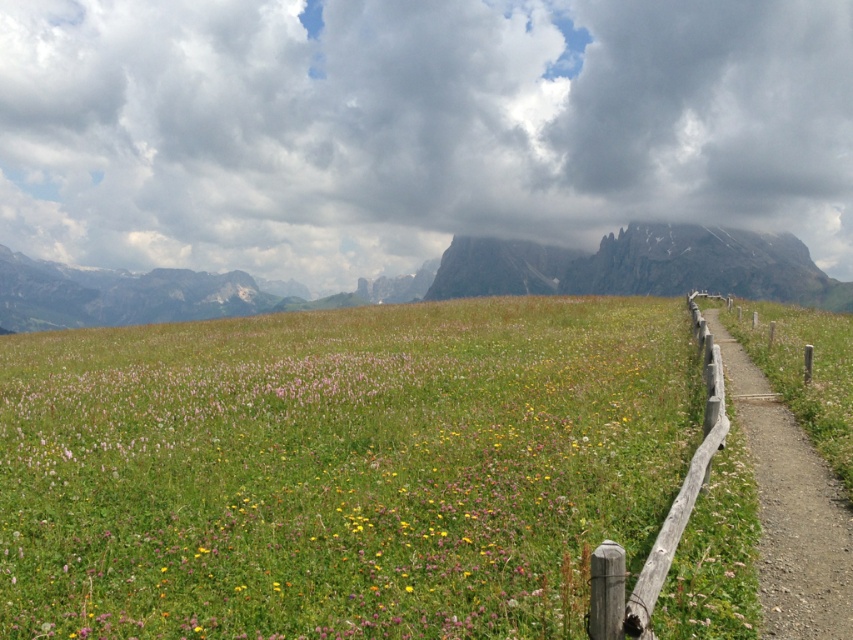
Question: Among these points, which one is farthest from the camera?

Choices:
 (A) (115, 492)
 (B) (769, 467)

Answer: (B)

Question: Is green grassy field at center to the left of wooden fence at right from the viewer's perspective?

Choices:
 (A) yes
 (B) no

Answer: (A)

Question: Observing the image, what is the correct spatial positioning of green grassy field at center in reference to wooden fence at right?

Choices:
 (A) right
 (B) left

Answer: (B)

Question: Which point is farther to the camera?

Choices:
 (A) (804, 547)
 (B) (624, 449)

Answer: (B)

Question: From the image, what is the correct spatial relationship of green grassy field at center in relation to wooden fence at right?

Choices:
 (A) below
 (B) above

Answer: (B)